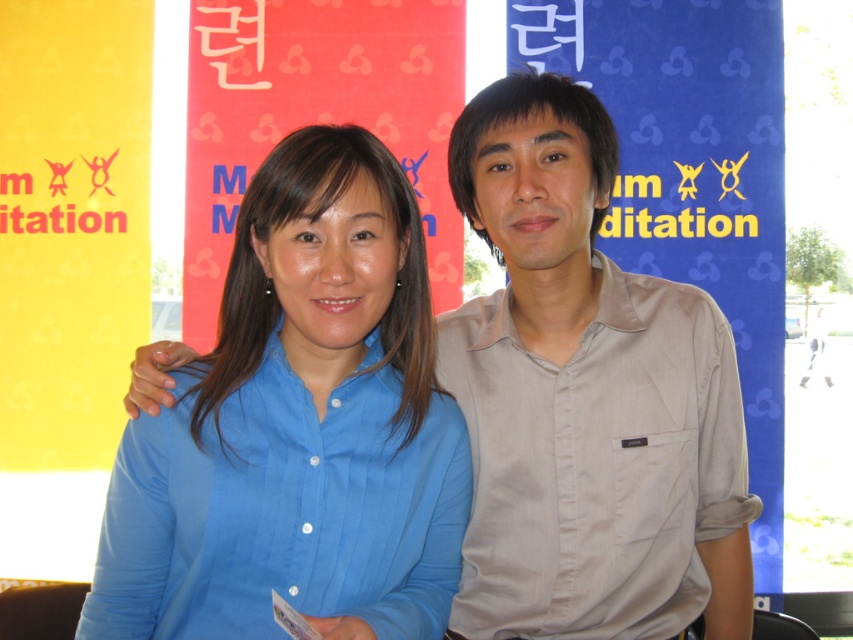
You are organizing a photo shoot and need to arrange two shirts for a promotional image. The scene requires the blue smooth shirt at center to be placed to the left of the beige cotton shirt at right. Based on the current arrangement in the image, is this requirement already met?

Yes, the blue smooth shirt at center is already positioned on the left side of the beige cotton shirt at right, so the requirement is met.

You are a photographer trying to capture a closeup shot of the two people in the image. You want to focus on the point at (149, 436) and the point at (569, 88). Which point should you focus on first to ensure the closest subject is in focus?

Point (149, 436) is closer to the viewer than point (569, 88), so you should focus on point (149, 436) first to ensure the closest subject is in focus.

You are a photographer at a meditation event and need to capture a photo where the blue smooth shirt at center and beige cotton shirt at right are both visible. Based on their heights, which shirt should be placed closer to the camera to ensure both are fully visible in the frame?

The blue smooth shirt at center is taller than the beige cotton shirt at right. To ensure both are fully visible, the beige cotton shirt at right should be placed closer to the camera so that the taller blue smooth shirt at center can be positioned behind it without blocking the shorter one.